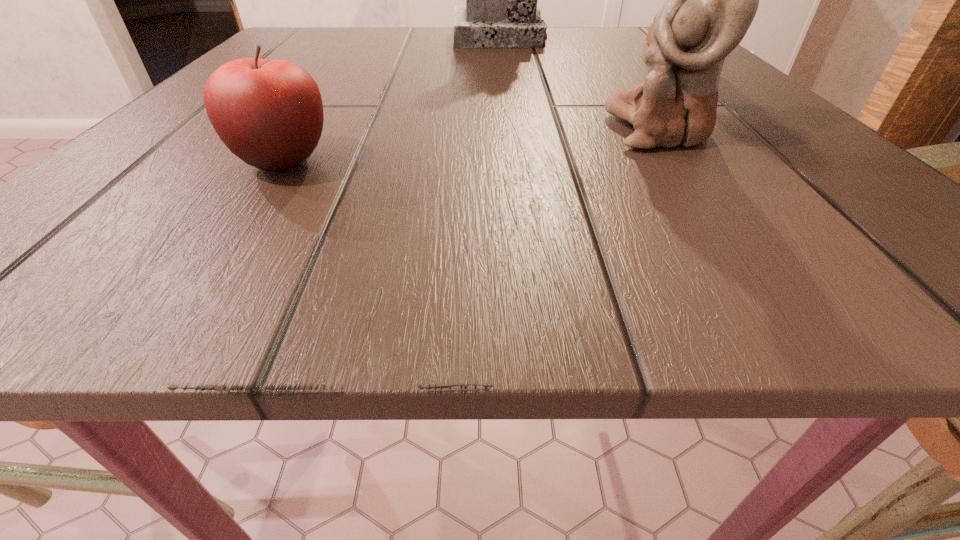
I want to click on free region located on the front-facing side of the second object from right to left, so click(x=570, y=130).

This screenshot has height=540, width=960. Find the location of `vacant space positioned on the front-facing side of the second object from right to left`. vacant space positioned on the front-facing side of the second object from right to left is located at coordinates (321, 130).

Find the location of a particular element. The image size is (960, 540). vacant area situated 0.150m on the front-facing side of the second object from right to left is located at coordinates (490, 130).

Identify the location of vacant space located 0.110m on the right of the shortest object. This screenshot has width=960, height=540. (433, 162).

You are a GUI agent. You are given a task and a screenshot of the screen. Output one action in this format:
    pyautogui.click(x=<x>, y=<y>)
    Task: Click on the object that is at the left edge
    This screenshot has width=960, height=540.
    Given the screenshot: What is the action you would take?
    pyautogui.click(x=269, y=113)

Locate an element on the screen. object located in the far right corner section of the desktop is located at coordinates coord(649,35).

In order to click on vacant area at the far edge in this screenshot , I will do `click(568, 46)`.

In the image, there is a desktop. What are the coordinates of `vacant region at the near edge` in the screenshot? It's located at tap(400, 245).

The height and width of the screenshot is (540, 960). What are the coordinates of `vacant space at the right edge` in the screenshot? It's located at (896, 214).

In the image, there is a desktop. What are the coordinates of `vacant space at the far left corner` in the screenshot? It's located at (321, 43).